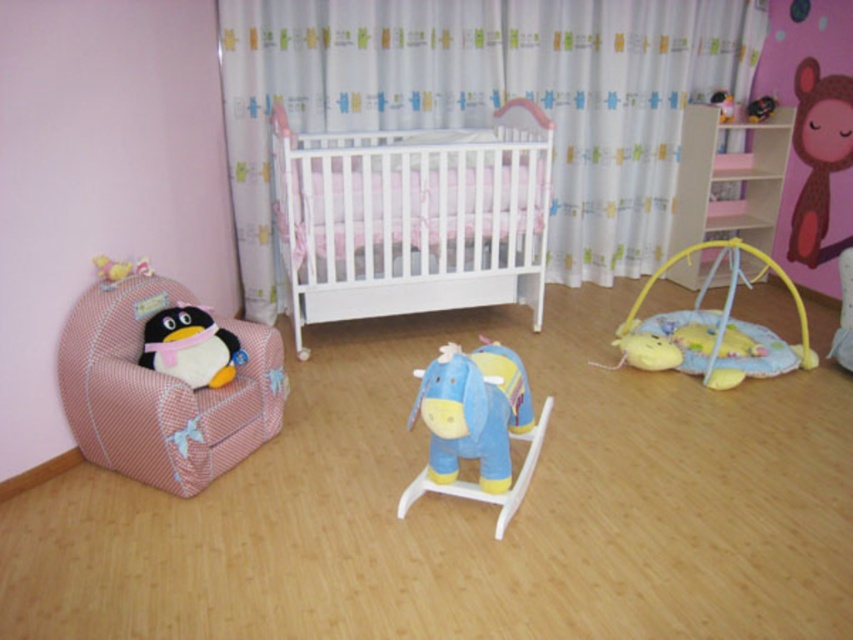
Can you confirm if white wooden crib at center is positioned below blue plush rocking horse at center?

No.

Describe the element at coordinates (413, 218) in the screenshot. I see `white wooden crib at center` at that location.

Locate an element on the screen. The height and width of the screenshot is (640, 853). white wooden crib at center is located at coordinates (413, 218).

Does white fabric curtain at center have a smaller size compared to matte black monkey at upper right?

No.

Is white fabric curtain at center thinner than matte black monkey at upper right?

In fact, white fabric curtain at center might be wider than matte black monkey at upper right.

Is point (257, 1) farther from camera compared to point (753, 120)?

No.

I want to click on white fabric curtain at center, so click(488, 100).

Can you confirm if blue plush rocking horse at center is shorter than soft yellow fabric play mat at lower right?

Yes.

Between point (433, 392) and point (788, 291), which one is positioned in front?

Point (433, 392)

Does point (427, 380) come closer to viewer compared to point (811, 349)?

Yes.

What are the coordinates of `blue plush rocking horse at center` in the screenshot? It's located at (476, 426).